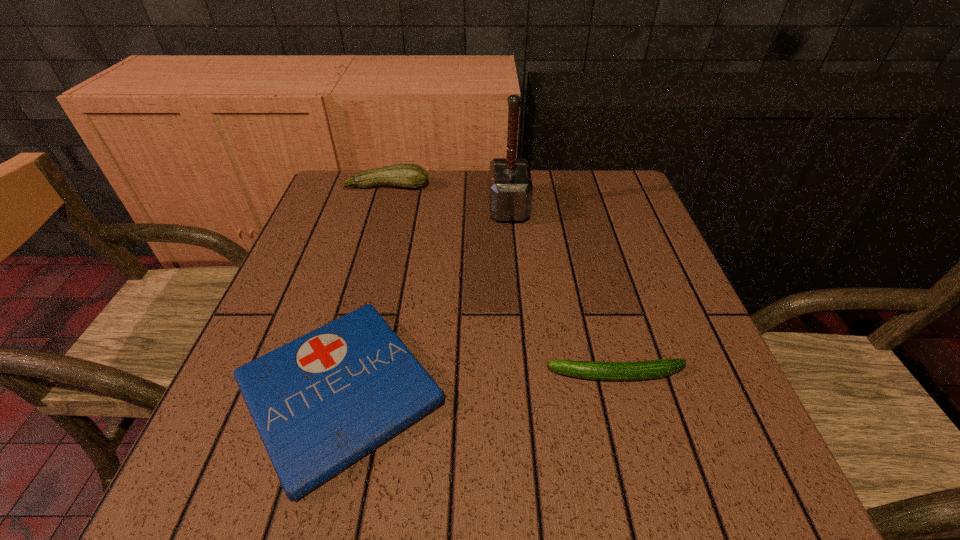
The width and height of the screenshot is (960, 540). I want to click on free space between the tallest object and the right zucchini, so click(x=563, y=291).

Where is `empty space between the first-aid kit and the nearer zucchini`? The height and width of the screenshot is (540, 960). empty space between the first-aid kit and the nearer zucchini is located at coordinates (478, 383).

You are a GUI agent. You are given a task and a screenshot of the screen. Output one action in this format:
    pyautogui.click(x=<x>, y=<y>)
    Task: Click on the free space between the hammer and the first-aid kit
    
    Given the screenshot: What is the action you would take?
    pyautogui.click(x=424, y=300)

The height and width of the screenshot is (540, 960). In order to click on free space between the first-aid kit and the taller zucchini in this screenshot , I will do `click(364, 289)`.

Identify which object is located as the second nearest to the tallest object. Please provide its 2D coordinates. Your answer should be formatted as a tuple, i.e. [(x, y)], where the tuple contains the x and y coordinates of a point satisfying the conditions above.

[(320, 403)]

Identify which object is the nearest to the left zucchini. Please provide its 2D coordinates. Your answer should be formatted as a tuple, i.e. [(x, y)], where the tuple contains the x and y coordinates of a point satisfying the conditions above.

[(510, 185)]

Locate an element on the screen. This screenshot has width=960, height=540. vacant area in the image that satisfies the following two spatial constraints: 1. at the stem end of the first-aid kit; 2. on the right side of the left zucchini is located at coordinates (327, 392).

This screenshot has width=960, height=540. Identify the location of free space in the image that satisfies the following two spatial constraints: 1. at the stem end of the taller zucchini; 2. on the right side of the hammer. (381, 207).

What are the coordinates of `free location that satisfies the following two spatial constraints: 1. at the stem end of the left zucchini; 2. on the right side of the first-aid kit` in the screenshot? It's located at (327, 392).